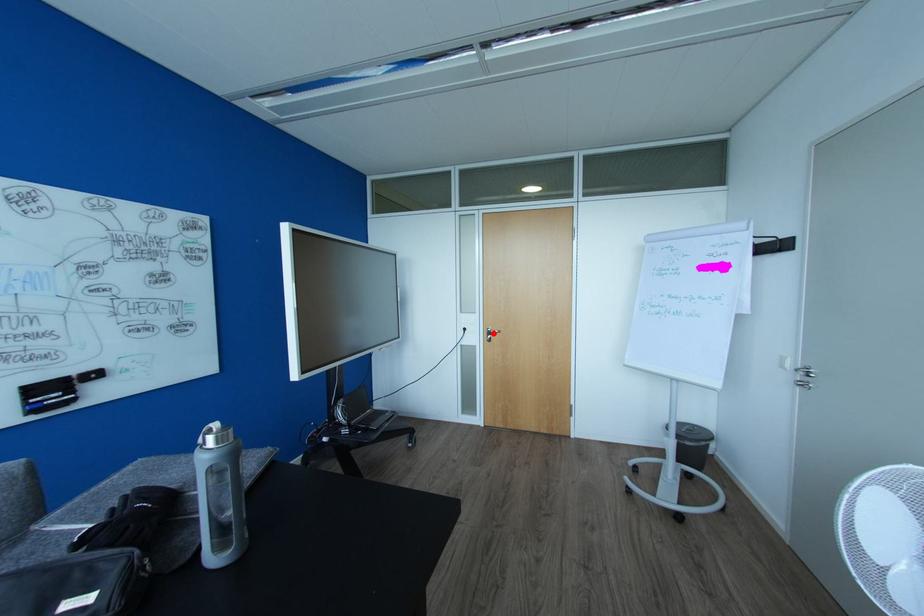
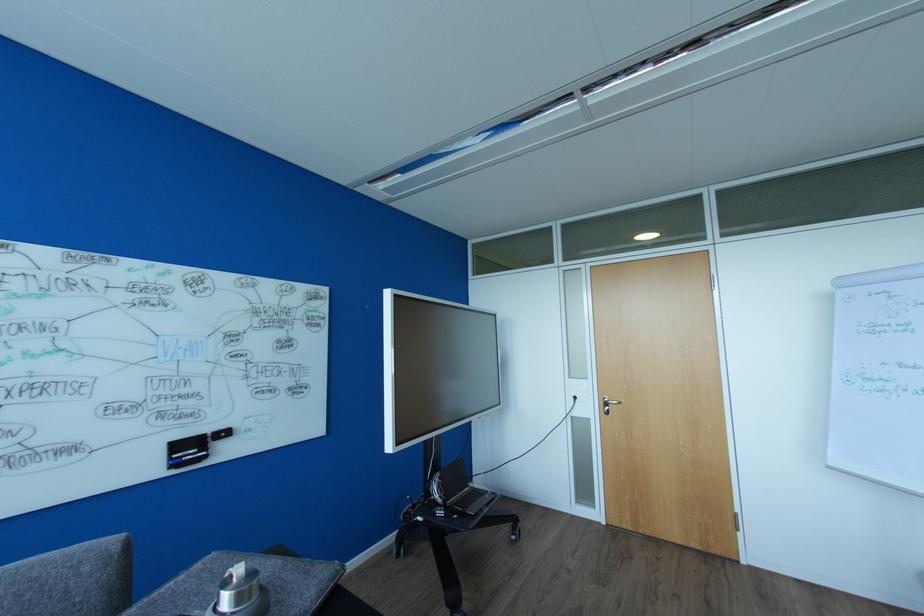
The point at the highlighted location is marked in the first image. Where is the corresponding point in the second image?

(610, 403)